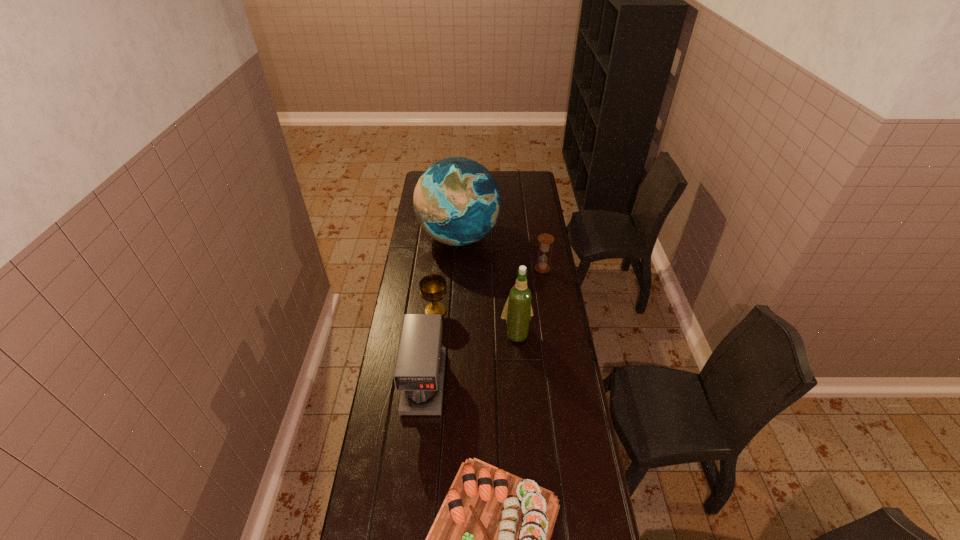
At what (x,y) coordinates should I click in order to perform the action: click on vacant space located 0.220m on the back of the chalice. Please return your answer as a coordinate pair (x, y). This screenshot has width=960, height=540. Looking at the image, I should click on (440, 269).

Find the location of a particular element. The width and height of the screenshot is (960, 540). globe that is at the left edge is located at coordinates (457, 201).

This screenshot has height=540, width=960. Identify the location of coffee maker that is at the left edge. (419, 370).

You are a GUI agent. You are given a task and a screenshot of the screen. Output one action in this format:
    pyautogui.click(x=<x>, y=<y>)
    Task: Click on the chalice present at the left edge
    This screenshot has width=960, height=540.
    Given the screenshot: What is the action you would take?
    pyautogui.click(x=432, y=287)

At what (x,y) coordinates should I click in order to perform the action: click on wine bottle situated at the right edge. Please return your answer as a coordinate pair (x, y). Image resolution: width=960 pixels, height=540 pixels. Looking at the image, I should click on (x=517, y=311).

You are a GUI agent. You are given a task and a screenshot of the screen. Output one action in this format:
    pyautogui.click(x=<x>, y=<y>)
    Task: Click on the hourglass that is at the right edge
    
    Given the screenshot: What is the action you would take?
    pyautogui.click(x=545, y=240)

You are a GUI agent. You are given a task and a screenshot of the screen. Output one action in this format:
    pyautogui.click(x=<x>, y=<y>)
    Task: Click on the free space at the left edge of the desktop
    This screenshot has width=960, height=540.
    Given the screenshot: What is the action you would take?
    384,424

The height and width of the screenshot is (540, 960). I want to click on vacant space at the right edge of the desktop, so click(541, 444).

The height and width of the screenshot is (540, 960). Identify the location of vacant space at the far right corner of the desktop. (518, 184).

Image resolution: width=960 pixels, height=540 pixels. In order to click on free space between the hourglass and the fourth shortest object in this screenshot , I will do `click(483, 326)`.